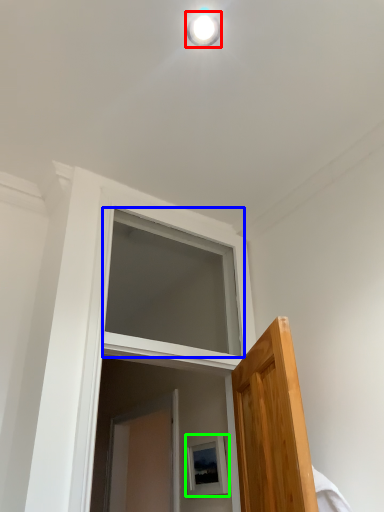
Question: Considering the real-world distances, which object is closest to light fixture (highlighted by a red box)? window (highlighted by a blue box) or picture frame (highlighted by a green box).

Choices:
 (A) window
 (B) picture frame

Answer: (A)